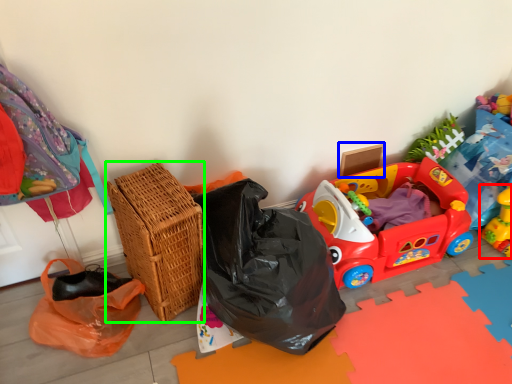
Question: Which object is the farthest from toy (highlighted by a red box)? Choose among these: cardboard box (highlighted by a blue box) or basket (highlighted by a green box).

Choices:
 (A) cardboard box
 (B) basket

Answer: (B)